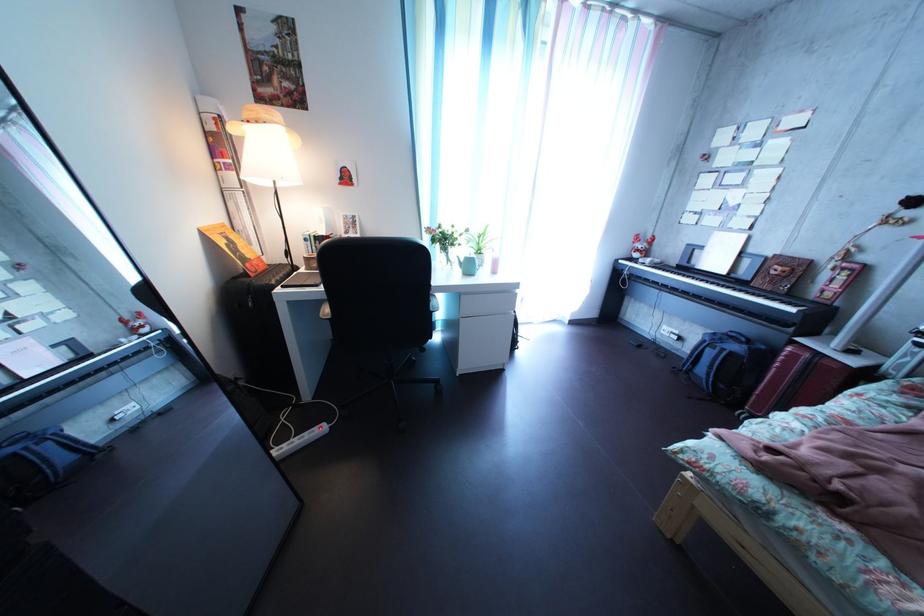
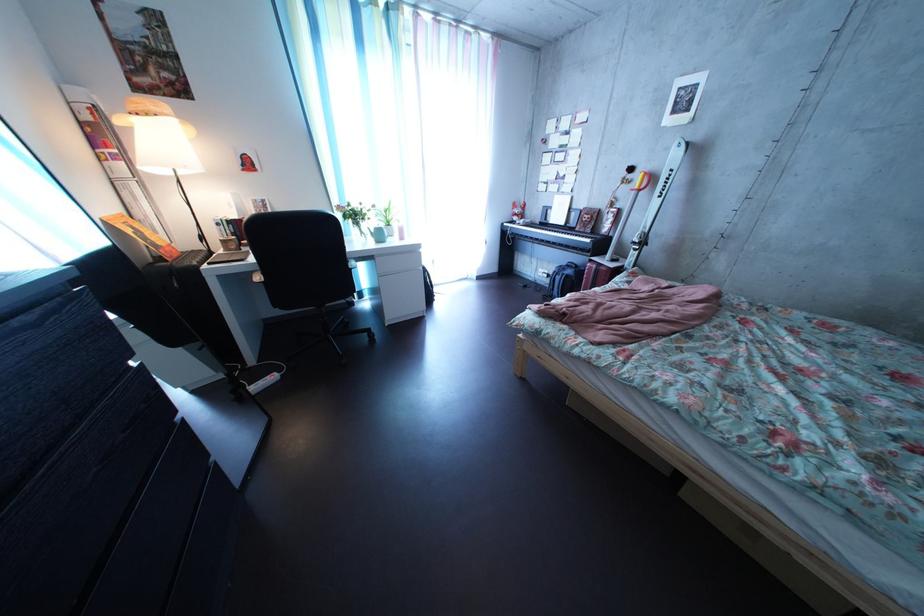
Find the pixel in the second image that matches [678,336] in the first image.

(554, 278)